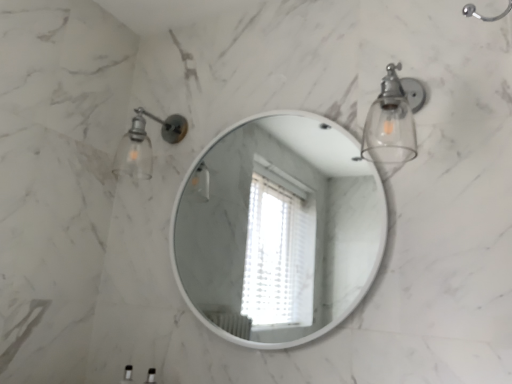
Question: Are matte glass sconce at upper left, the first light fixture when ordered from left to right, and white glossy mirror at center located far from each other?

Choices:
 (A) no
 (B) yes

Answer: (B)

Question: Is matte glass sconce at upper left, acting as the first light fixture starting from the back, turned away from white glossy mirror at center?

Choices:
 (A) no
 (B) yes

Answer: (A)

Question: Does matte glass sconce at upper left, acting as the first light fixture starting from the back, appear on the right side of white glossy mirror at center?

Choices:
 (A) no
 (B) yes

Answer: (A)

Question: Is matte glass sconce at upper left, acting as the first light fixture starting from the back, bigger than white glossy mirror at center?

Choices:
 (A) yes
 (B) no

Answer: (B)

Question: Is matte glass sconce at upper left, acting as the 2th light fixture starting from the right, thinner than white glossy mirror at center?

Choices:
 (A) yes
 (B) no

Answer: (B)

Question: From the image's perspective, is matte glass sconce at upper left, the first light fixture when ordered from left to right, located beneath white glossy mirror at center?

Choices:
 (A) no
 (B) yes

Answer: (A)

Question: Is matte glass sconce at upper left, acting as the 2th light fixture starting from the right, surrounded by white glossy mirror at center?

Choices:
 (A) yes
 (B) no

Answer: (B)

Question: Does white glossy mirror at center have a lesser width compared to matte glass sconce at upper left, the first light fixture when ordered from left to right?

Choices:
 (A) no
 (B) yes

Answer: (B)

Question: Is the position of white glossy mirror at center more distant than that of matte glass sconce at upper left, which is counted as the 2th light fixture, starting from the front?

Choices:
 (A) no
 (B) yes

Answer: (A)

Question: From a real-world perspective, is white glossy mirror at center positioned under matte glass sconce at upper left, the first light fixture when ordered from left to right, based on gravity?

Choices:
 (A) no
 (B) yes

Answer: (B)

Question: Is white glossy mirror at center closer to the viewer compared to matte glass sconce at upper left, the first light fixture when ordered from left to right?

Choices:
 (A) no
 (B) yes

Answer: (B)

Question: From a real-world perspective, is white glossy mirror at center physically above matte glass sconce at upper left, which is counted as the 2th light fixture, starting from the front?

Choices:
 (A) yes
 (B) no

Answer: (B)

Question: From a real-world perspective, is clear glass sconce at upper right, the first light fixture viewed from the right, positioned under white glossy mirror at center based on gravity?

Choices:
 (A) yes
 (B) no

Answer: (B)